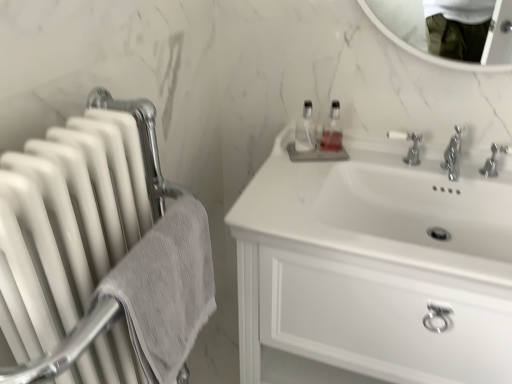
The image size is (512, 384). I want to click on free region on the left part of translucent plastic soap dispenser at upper center, so click(x=286, y=160).